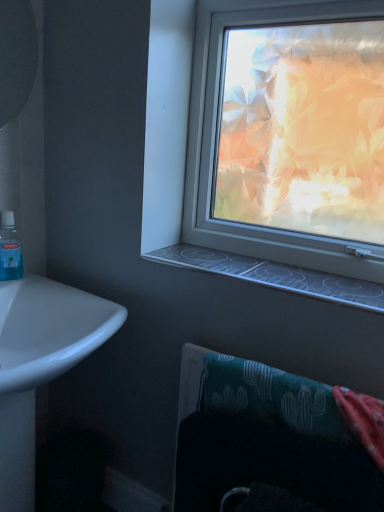
Question: Can you confirm if blue translucent mouthwash at left is taller than white glossy sink at lower left?

Choices:
 (A) no
 (B) yes

Answer: (A)

Question: From the image's perspective, is blue translucent mouthwash at left located beneath white glossy sink at lower left?

Choices:
 (A) yes
 (B) no

Answer: (B)

Question: Is blue translucent mouthwash at left to the left of white glossy sink at lower left from the viewer's perspective?

Choices:
 (A) yes
 (B) no

Answer: (A)

Question: Considering the relative sizes of blue translucent mouthwash at left and white glossy sink at lower left in the image provided, is blue translucent mouthwash at left smaller than white glossy sink at lower left?

Choices:
 (A) no
 (B) yes

Answer: (B)

Question: Is blue translucent mouthwash at left at the right side of white glossy sink at lower left?

Choices:
 (A) no
 (B) yes

Answer: (A)

Question: In terms of height, does white glossy sink at lower left look taller or shorter compared to teal fabric towel at lower right?

Choices:
 (A) tall
 (B) short

Answer: (A)

Question: In the image, is white glossy sink at lower left positioned in front of or behind teal fabric towel at lower right?

Choices:
 (A) behind
 (B) front

Answer: (B)

Question: From the image's perspective, is white glossy sink at lower left located above or below teal fabric towel at lower right?

Choices:
 (A) above
 (B) below

Answer: (B)

Question: Considering the positions of point (4, 459) and point (304, 428), is point (4, 459) closer or farther from the camera than point (304, 428)?

Choices:
 (A) closer
 (B) farther

Answer: (B)

Question: Based on their positions, is teal fabric towel at lower right located to the left or right of blue translucent mouthwash at left?

Choices:
 (A) right
 (B) left

Answer: (A)

Question: From the image's perspective, is teal fabric towel at lower right above or below blue translucent mouthwash at left?

Choices:
 (A) below
 (B) above

Answer: (A)

Question: Considering their positions, is teal fabric towel at lower right located in front of or behind blue translucent mouthwash at left?

Choices:
 (A) front
 (B) behind

Answer: (A)

Question: Considering the positions of teal fabric towel at lower right and blue translucent mouthwash at left in the image, is teal fabric towel at lower right wider or thinner than blue translucent mouthwash at left?

Choices:
 (A) thin
 (B) wide

Answer: (B)

Question: From a real-world perspective, is white glossy sink at lower left above or below clear plastic window sill at center?

Choices:
 (A) above
 (B) below

Answer: (B)

Question: Would you say white glossy sink at lower left is inside or outside clear plastic window sill at center?

Choices:
 (A) inside
 (B) outside

Answer: (B)